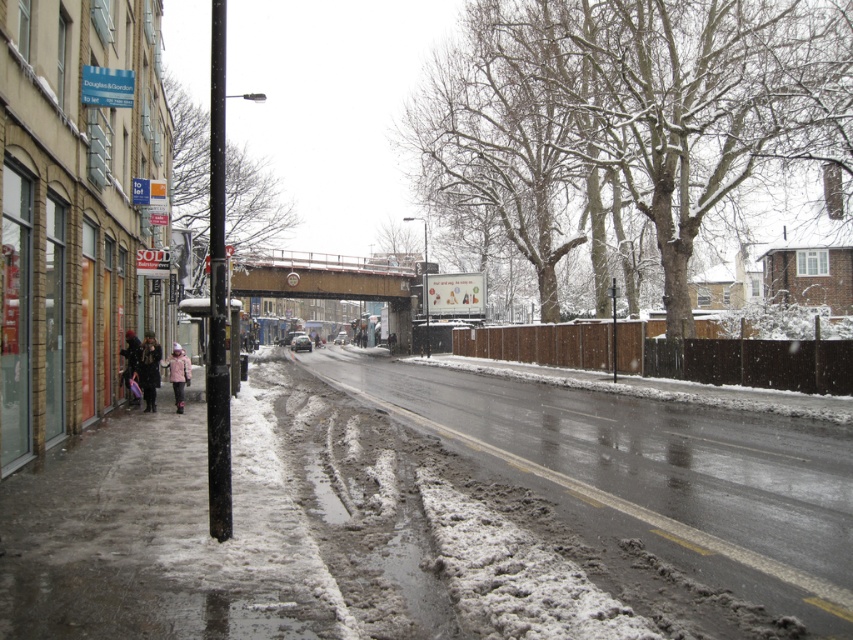
You are standing at the point with coordinates point (173,353) and want to walk towards the point (146,403). Given that both points are on the snowy sidewalk, will you be moving towards or away from the buildings on the left side of the image?

Since point (146,403) is closer to the viewer than point (173,353), walking towards it means you are moving away from the buildings on the left side of the image.

You are a delivery person trying to walk from the snowy concrete sidewalk at lower left to the black metal pole at left. Which direction should you move to reach the pole?

The snowy concrete sidewalk at lower left is positioned under the black metal pole at left, so you should move upward towards the pole.